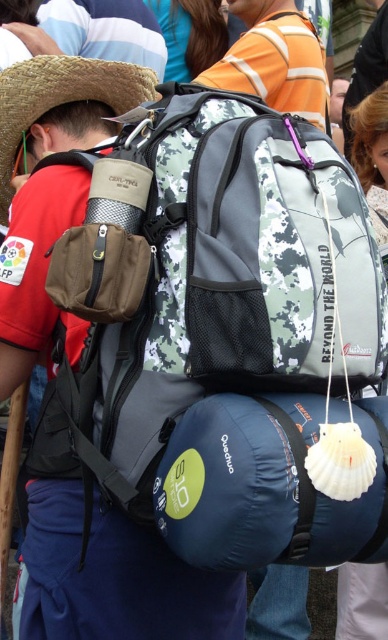
You are a photographer setting up a shoot and notice a straw hat at upper left and a dark brown leather jacket at upper center in the frame. Which item is closer to the camera?

The dark brown leather jacket at upper center is closer to the camera because the straw hat at upper left is positioned under it, indicating it is behind the jacket.

You are standing in front of the backpack and want to place a sticker exactly at the point with coordinates point (275,60). According to the image, where will the sticker be placed?

The sticker will be placed on the camouflage backpack at center, as point (275,60) is on camouflage backpack at center.

You are a photographer trying to capture the camouflage backpack at center and the straw hat at upper left in a single shot. Based on their positions, which object should you focus on first to ensure both are in the frame?

The camouflage backpack at center is located above the straw hat at upper left, so you should focus on the straw hat at upper left first to ensure both are in the frame.